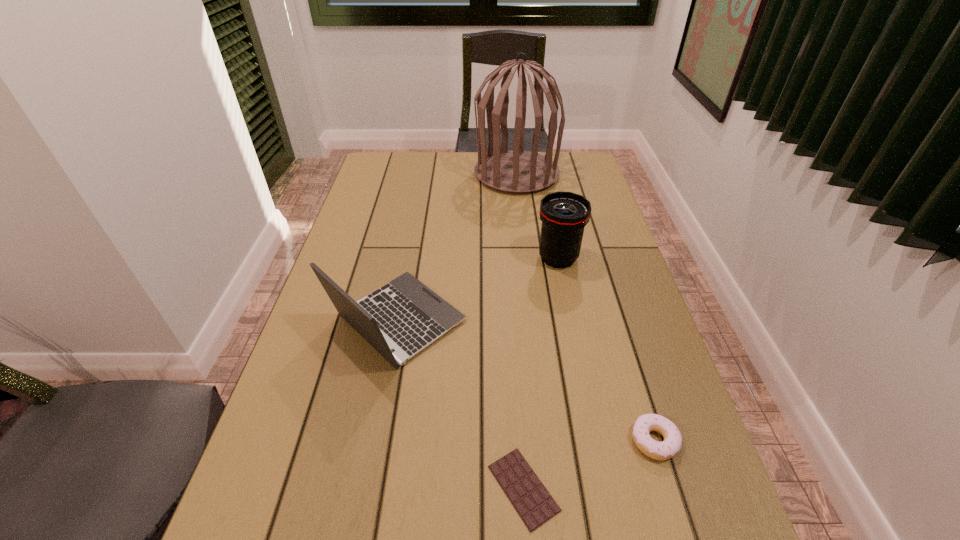
Find the location of a particular element. blank region between the laptop_computer and the rightmost object is located at coordinates (526, 381).

This screenshot has height=540, width=960. I want to click on free space between the tallest object and the fourth nearest object, so pyautogui.click(x=538, y=216).

Where is `free space between the third nearest object and the telephoto lens`? The height and width of the screenshot is (540, 960). free space between the third nearest object and the telephoto lens is located at coordinates (477, 289).

Find the location of a particular element. This screenshot has width=960, height=540. object that is the second nearest to the third farthest object is located at coordinates (564, 215).

Identify which object is the second closest to the shortest object. Please provide its 2D coordinates. Your answer should be formatted as a tuple, i.e. [(x, y)], where the tuple contains the x and y coordinates of a point satisfying the conditions above.

[(406, 316)]